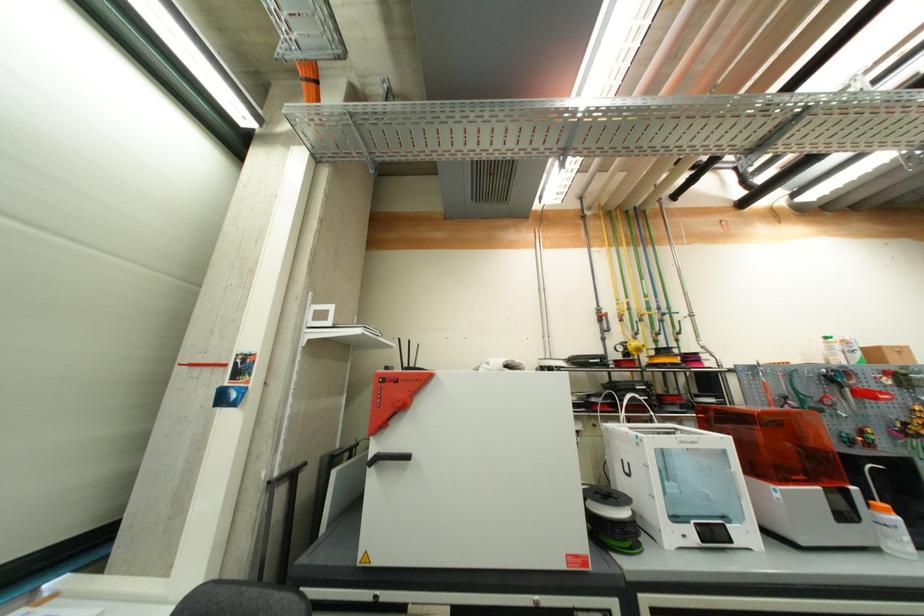
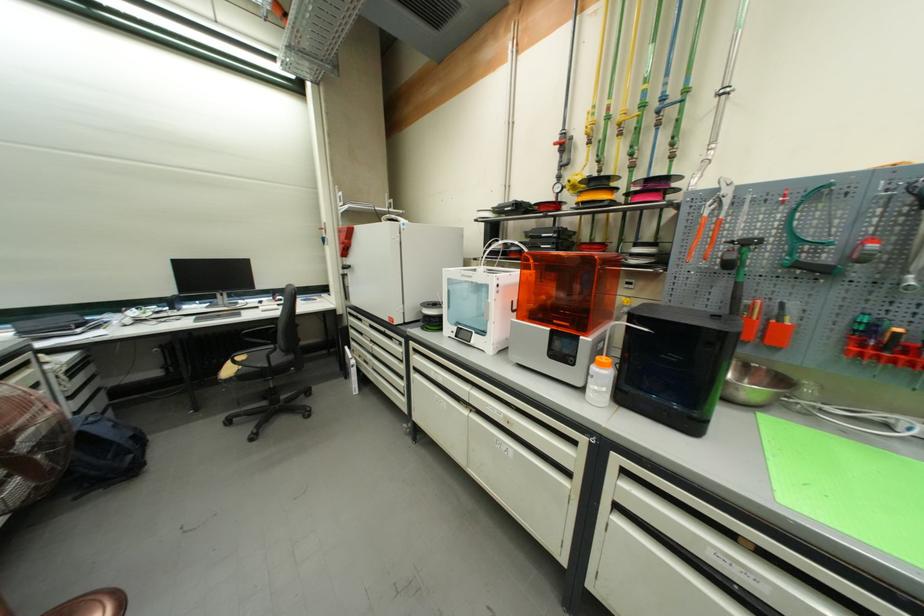
The point at [891,513] is marked in the first image. Where is the corresponding point in the second image?

(606, 367)